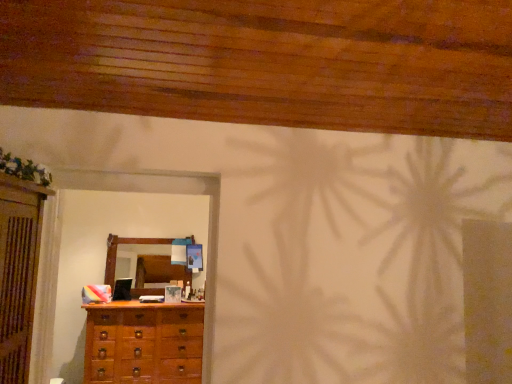
Question: Does wooden chest of drawers at lower left have a greater height compared to wooden mirror at center?

Choices:
 (A) yes
 (B) no

Answer: (A)

Question: From the image's perspective, is wooden chest of drawers at lower left over wooden mirror at center?

Choices:
 (A) no
 (B) yes

Answer: (A)

Question: Are wooden chest of drawers at lower left and wooden mirror at center beside each other?

Choices:
 (A) yes
 (B) no

Answer: (B)

Question: Is wooden chest of drawers at lower left positioned far away from wooden mirror at center?

Choices:
 (A) no
 (B) yes

Answer: (A)

Question: Is wooden chest of drawers at lower left facing away from wooden mirror at center?

Choices:
 (A) yes
 (B) no

Answer: (B)

Question: Does wooden chest of drawers at lower left have a lesser height compared to wooden mirror at center?

Choices:
 (A) no
 (B) yes

Answer: (A)

Question: Is wooden mirror at center behind wooden chest of drawers at lower left?

Choices:
 (A) no
 (B) yes

Answer: (B)

Question: Does wooden mirror at center have a smaller size compared to wooden chest of drawers at lower left?

Choices:
 (A) no
 (B) yes

Answer: (B)

Question: Does wooden mirror at center have a lesser width compared to wooden chest of drawers at lower left?

Choices:
 (A) no
 (B) yes

Answer: (B)

Question: Is wooden mirror at center aimed at wooden chest of drawers at lower left?

Choices:
 (A) no
 (B) yes

Answer: (A)

Question: Does wooden mirror at center contain wooden chest of drawers at lower left?

Choices:
 (A) yes
 (B) no

Answer: (B)

Question: Considering the relative sizes of wooden mirror at center and wooden chest of drawers at lower left in the image provided, is wooden mirror at center shorter than wooden chest of drawers at lower left?

Choices:
 (A) no
 (B) yes

Answer: (B)

Question: Is point (121, 321) positioned closer to the camera than point (125, 246)?

Choices:
 (A) closer
 (B) farther

Answer: (A)